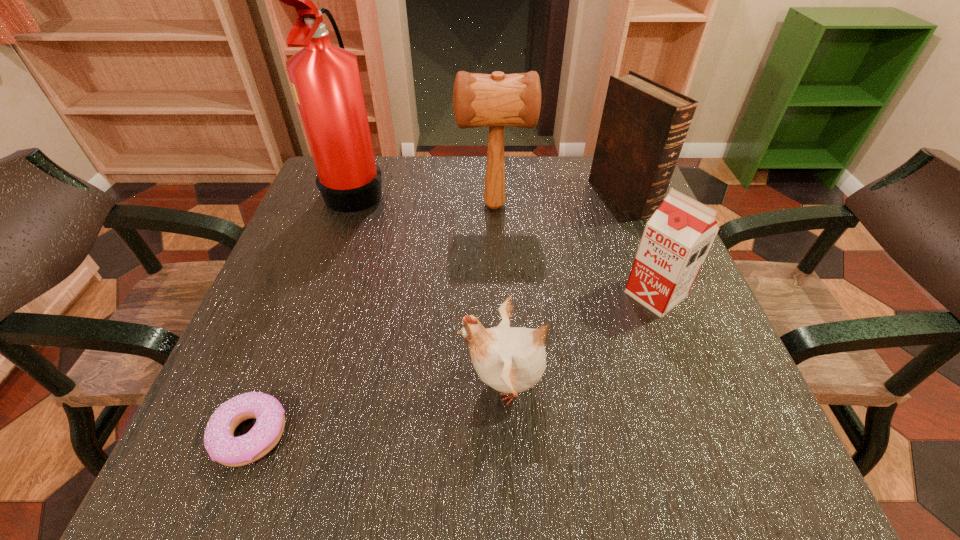
Locate an element on the screen. fire extinguisher is located at coordinates (326, 81).

Locate an element on the screen. mallet is located at coordinates (497, 100).

At what (x,y) coordinates should I click in order to perform the action: click on the third tallest object. Please return your answer as a coordinate pair (x, y). The image size is (960, 540). Looking at the image, I should click on (644, 124).

Where is `soya milk`? Image resolution: width=960 pixels, height=540 pixels. soya milk is located at coordinates (677, 238).

Where is `the fourth farthest object`? The image size is (960, 540). the fourth farthest object is located at coordinates (677, 238).

I want to click on the fifth tallest object, so click(511, 360).

Image resolution: width=960 pixels, height=540 pixels. Find the location of `doughnut`. doughnut is located at coordinates (220, 443).

The width and height of the screenshot is (960, 540). Find the location of `free region located 0.340m at the spray nozzle of the fire extinguisher`. free region located 0.340m at the spray nozzle of the fire extinguisher is located at coordinates (523, 189).

Locate an element on the screen. free space located on the strike surface of the mallet is located at coordinates (326, 206).

The width and height of the screenshot is (960, 540). I want to click on vacant space positioned 0.280m on the strike surface of the mallet, so click(x=339, y=206).